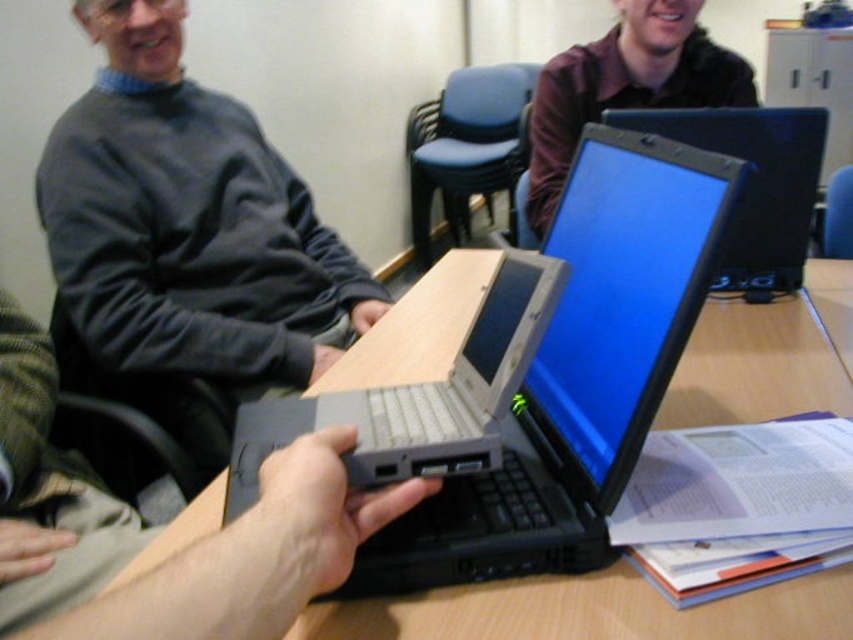
Question: Does dark gray sweater at upper left appear on the right side of wooden table at center?

Choices:
 (A) yes
 (B) no

Answer: (B)

Question: Which point appears closest to the camera in this image?

Choices:
 (A) (331, 460)
 (B) (71, 288)
 (C) (746, 115)
 (D) (717, 340)

Answer: (A)

Question: Which point appears farthest from the camera in this image?

Choices:
 (A) (202, 353)
 (B) (735, 140)

Answer: (A)

Question: Among these points, which one is farthest from the camera?

Choices:
 (A) (550, 605)
 (B) (207, 620)
 (C) (80, 180)

Answer: (C)

Question: Is matte brown shirt at upper center positioned in front of black glossy laptop at center?

Choices:
 (A) no
 (B) yes

Answer: (A)

Question: Can you confirm if matte brown shirt at upper center is positioned below black glossy laptop at center?

Choices:
 (A) yes
 (B) no

Answer: (B)